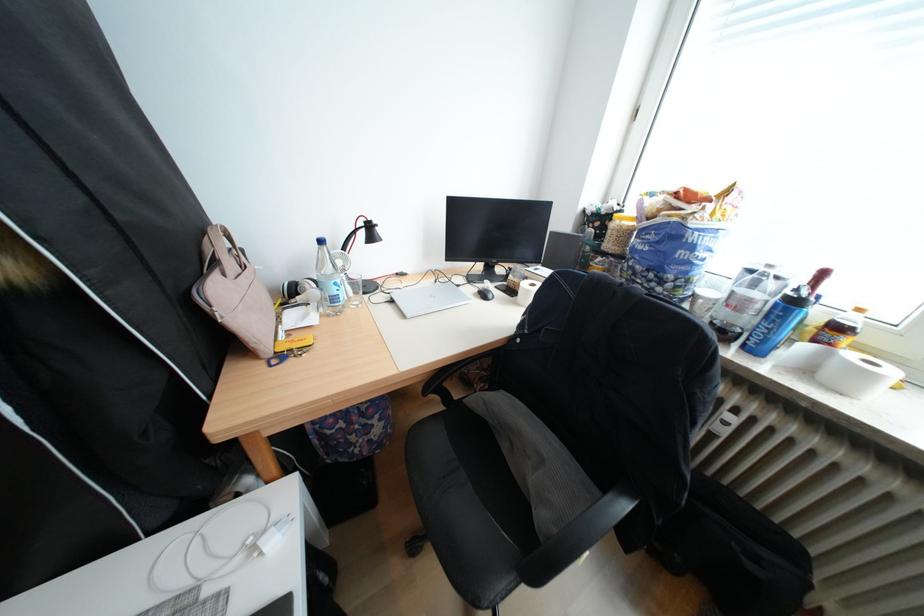
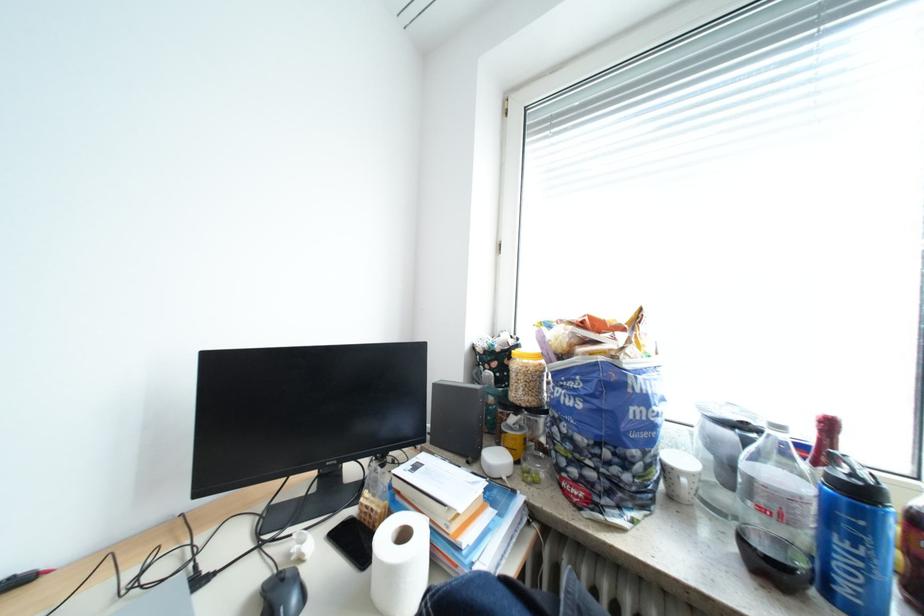
The point at (808, 302) is marked in the first image. Where is the corresponding point in the second image?

(873, 493)